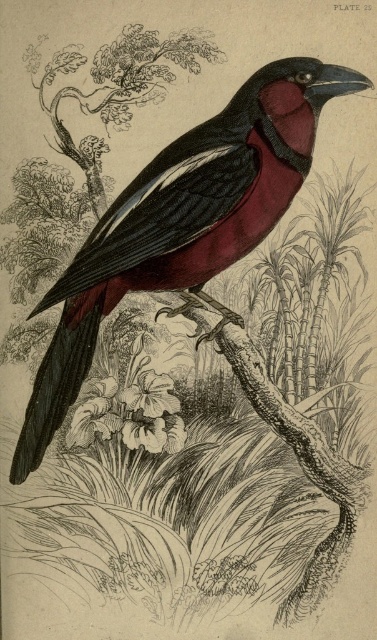
You are an ornithologist studying birds in a tropical forest. You have a map with coordinates pointing to a specific location in the image. The coordinates are point (182, 221). What bird species is located at this coordinate?

The point (182, 221) corresponds to the matte black bird at center.